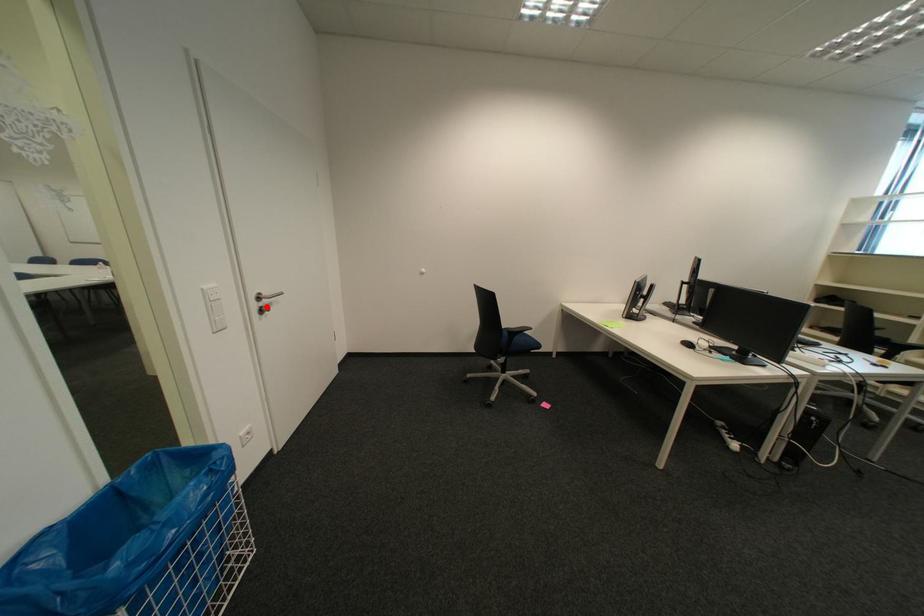
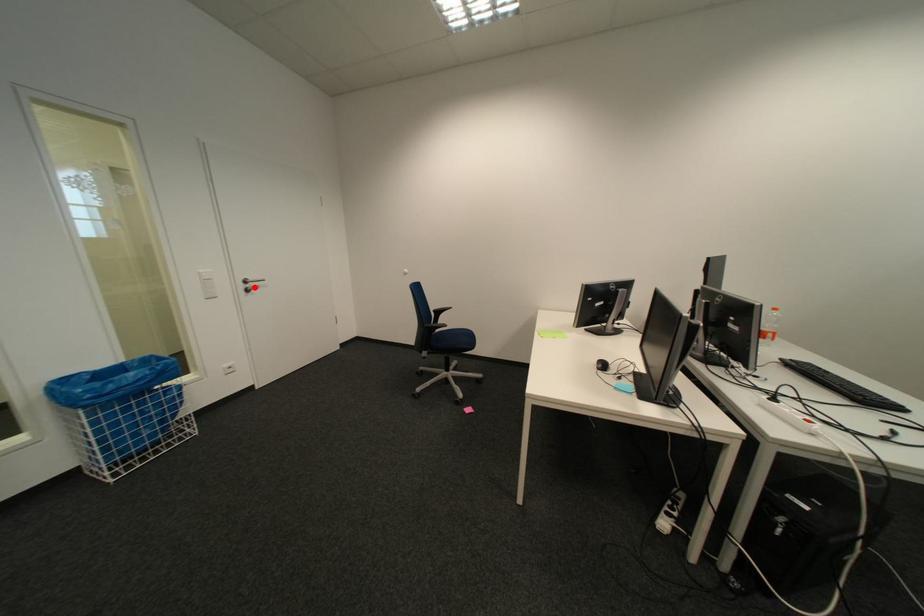
I am providing you with two images of the same scene from different viewpoints. A red point is marked on the first image and another point is marked on the second image. Do the highlighted points in image1 and image2 indicate the same real-world spot?

Yes